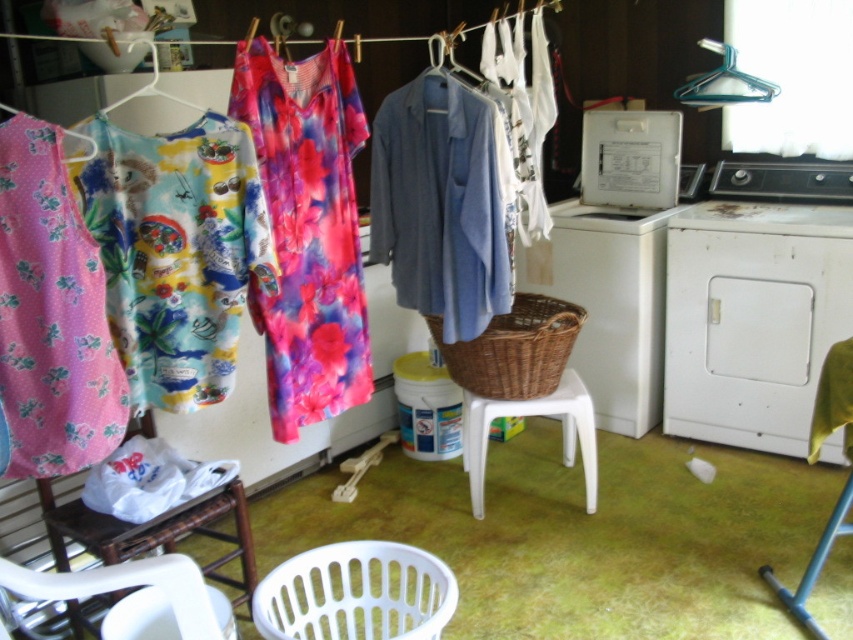
Question: Does fluffy fabric dress at left lie behind pink floral fabric dress at left?

Choices:
 (A) no
 (B) yes

Answer: (B)

Question: From the image, what is the correct spatial relationship of white plastic washing machine at center in relation to white plastic hanger at upper left?

Choices:
 (A) above
 (B) below

Answer: (B)

Question: Which point is closer to the camera?

Choices:
 (A) [695, 93]
 (B) [250, 129]

Answer: (B)

Question: Does white matte washing machine at right appear under pink floral fabric dress at left?

Choices:
 (A) no
 (B) yes

Answer: (A)

Question: Which object appears farthest from the camera in this image?

Choices:
 (A) woven brown basket at center
 (B) white plastic chair at lower left
 (C) white plastic hanger at upper left
 (D) pink floral fabric dress at left

Answer: (A)

Question: Which object is the closest to the white plastic washing machine at center?

Choices:
 (A) metallic blue hanger at upper right
 (B) white matte washing machine at right

Answer: (B)